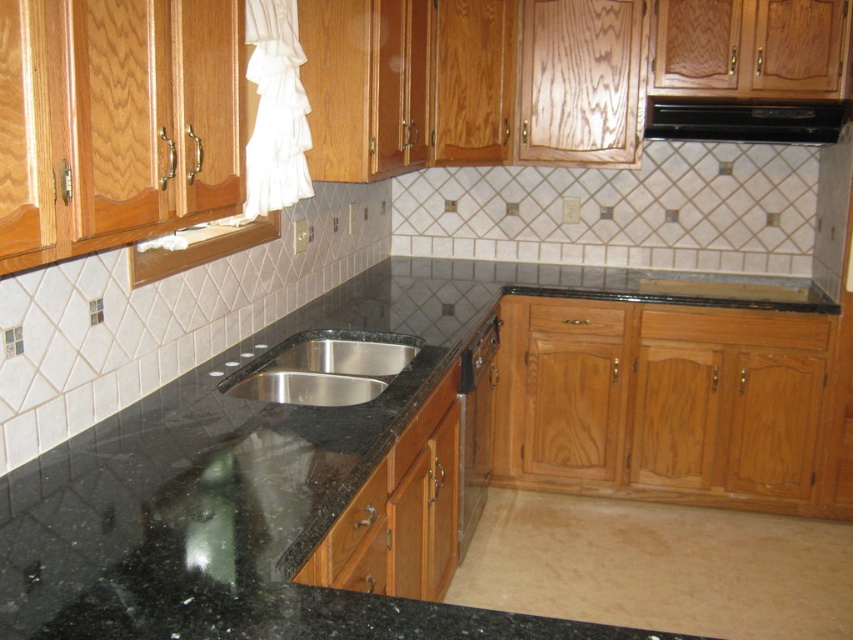
Question: Is black matte exhaust hood at upper right above wooden dishwasher at lower right?

Choices:
 (A) no
 (B) yes

Answer: (B)

Question: Which object appears farthest from the camera in this image?

Choices:
 (A) wooden dishwasher at lower right
 (B) black granite countertop at center
 (C) stainless steel sink at center

Answer: (A)

Question: Does black granite countertop at center have a greater width compared to wooden dishwasher at lower right?

Choices:
 (A) yes
 (B) no

Answer: (A)

Question: Does black granite countertop at center appear over wooden dishwasher at lower right?

Choices:
 (A) no
 (B) yes

Answer: (B)

Question: Which of the following is the farthest from the observer?

Choices:
 (A) (784, 134)
 (B) (488, 378)

Answer: (A)

Question: Which object is positioned closest to the wooden dishwasher at lower right?

Choices:
 (A) black matte exhaust hood at upper right
 (B) black granite countertop at center

Answer: (B)